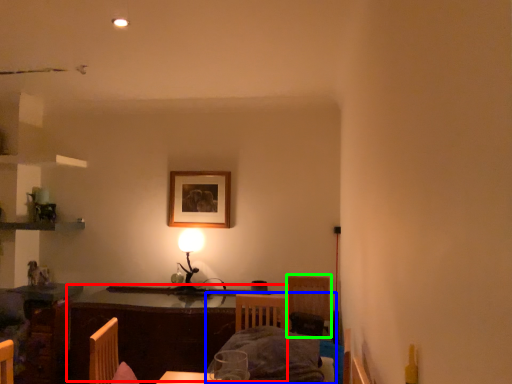
Question: Considering the real-world distances, which object is closest to table (highlighted by a red box)? bed (highlighted by a blue box) or armchair (highlighted by a green box).

Choices:
 (A) bed
 (B) armchair

Answer: (A)